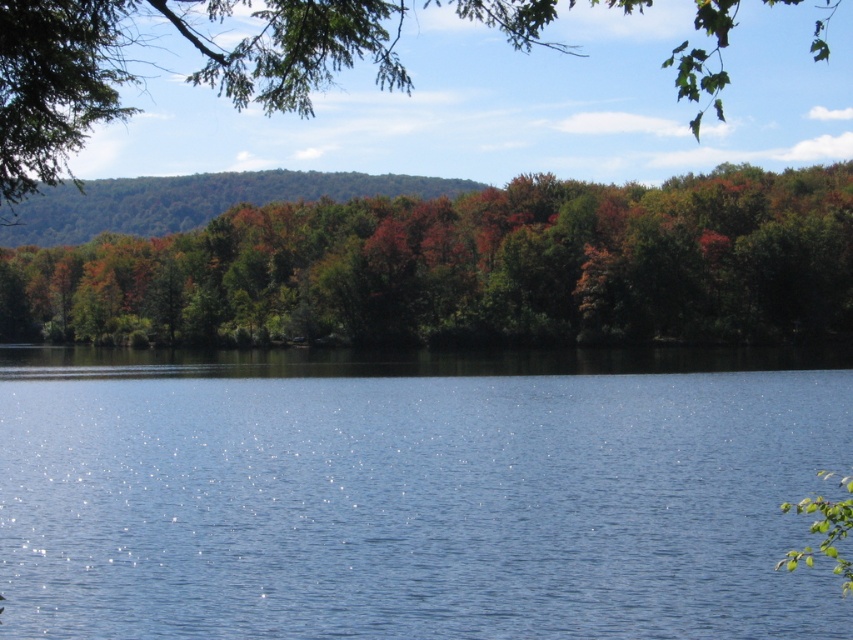
Question: Which of the following is the farthest from the observer?

Choices:
 (A) green leafy trees at center
 (B) blue liquid water at center
 (C) green matte tree at upper center

Answer: (A)

Question: Does green leafy trees at center appear under green matte tree at upper center?

Choices:
 (A) yes
 (B) no

Answer: (A)

Question: From the image, what is the correct spatial relationship of blue liquid water at center in relation to green matte tree at upper center?

Choices:
 (A) left
 (B) right

Answer: (B)

Question: Can you confirm if blue liquid water at center is positioned above green leafy trees at center?

Choices:
 (A) no
 (B) yes

Answer: (A)

Question: Which of the following is the closest to the observer?

Choices:
 (A) green matte tree at upper center
 (B) blue liquid water at center
 (C) green leafy trees at center

Answer: (A)

Question: Which point is farther from the camera taking this photo?

Choices:
 (A) (752, 480)
 (B) (686, 81)
 (C) (305, 216)

Answer: (B)